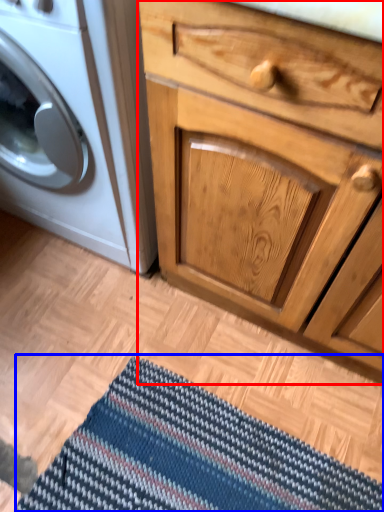
Question: Among these objects, which one is farthest to the camera, chest of drawers (highlighted by a red box) or doormat (highlighted by a blue box)?

Choices:
 (A) chest of drawers
 (B) doormat

Answer: (B)